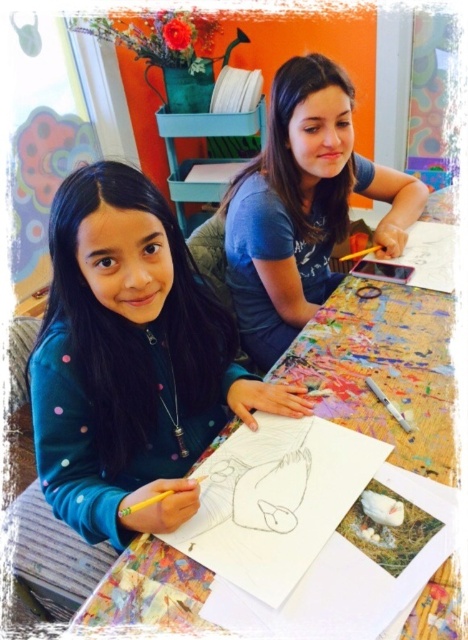
Question: Which of the following is the closest to the observer?

Choices:
 (A) wooden table at center
 (B) teal fleece jacket at lower left
 (C) blue cotton shirt at upper center

Answer: (A)

Question: Can you confirm if teal fleece jacket at lower left is positioned to the right of wooden table at center?

Choices:
 (A) no
 (B) yes

Answer: (A)

Question: Which of the following is the farthest from the observer?

Choices:
 (A) teal fleece jacket at lower left
 (B) blue cotton shirt at upper center

Answer: (B)

Question: Is wooden table at center to the left of blue cotton shirt at upper center from the viewer's perspective?

Choices:
 (A) yes
 (B) no

Answer: (A)

Question: In this image, where is wooden table at center located relative to blue cotton shirt at upper center?

Choices:
 (A) above
 (B) below

Answer: (B)

Question: Which point is farther from the camera taking this photo?

Choices:
 (A) (133, 586)
 (B) (58, 195)
 (C) (409, 202)

Answer: (C)